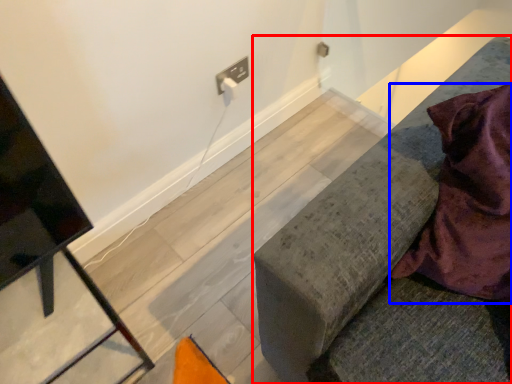
Question: Which object is further to the camera taking this photo, furniture (highlighted by a red box) or blanket (highlighted by a blue box)?

Choices:
 (A) furniture
 (B) blanket

Answer: (B)